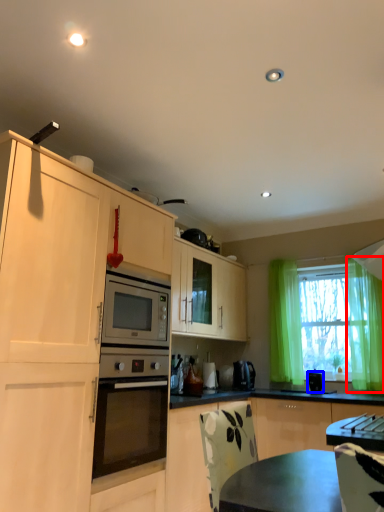
Question: Which object appears closest to the camera in this image, curtain (highlighted by a red box) or appliance (highlighted by a blue box)?

Choices:
 (A) curtain
 (B) appliance

Answer: (A)